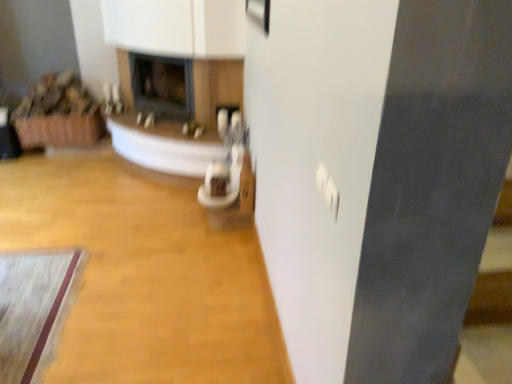
Question: Which direction should I rotate to face matte black fireplace at center, the second fireplace positioned from the left, — up or down?

Choices:
 (A) up
 (B) down

Answer: (A)

Question: Does wooden floor at center touch matte black fireplace at center, the 2th fireplace from the right?

Choices:
 (A) no
 (B) yes

Answer: (A)

Question: Can you confirm if wooden floor at center is smaller than matte black fireplace at center, the first fireplace when ordered from left to right?

Choices:
 (A) no
 (B) yes

Answer: (A)

Question: From a real-world perspective, does wooden floor at center stand above matte black fireplace at center, the 2th fireplace from the right?

Choices:
 (A) no
 (B) yes

Answer: (A)

Question: From the image's perspective, is wooden floor at center beneath matte black fireplace at center, the 2th fireplace from the right?

Choices:
 (A) yes
 (B) no

Answer: (A)

Question: Is wooden floor at center behind matte black fireplace at center, the first fireplace when ordered from left to right?

Choices:
 (A) yes
 (B) no

Answer: (B)

Question: Is wooden floor at center not close to matte black fireplace at center, the 2th fireplace from the right?

Choices:
 (A) no
 (B) yes

Answer: (A)

Question: Can you confirm if wooden floor at center is positioned to the left of matte black fireplace at center, the second fireplace positioned from the left?

Choices:
 (A) yes
 (B) no

Answer: (A)

Question: From the image's perspective, is wooden floor at center below matte black fireplace at center, the second fireplace positioned from the left?

Choices:
 (A) yes
 (B) no

Answer: (A)

Question: Is wooden floor at center positioned beyond the bounds of matte black fireplace at center, acting as the first fireplace starting from the right?

Choices:
 (A) yes
 (B) no

Answer: (A)

Question: Is the depth of wooden floor at center greater than that of matte black fireplace at center, acting as the first fireplace starting from the right?

Choices:
 (A) no
 (B) yes

Answer: (A)

Question: Does wooden floor at center turn towards matte black fireplace at center, acting as the first fireplace starting from the right?

Choices:
 (A) no
 (B) yes

Answer: (A)

Question: From a real-world perspective, is wooden floor at center positioned over matte black fireplace at center, the second fireplace positioned from the left, based on gravity?

Choices:
 (A) yes
 (B) no

Answer: (B)

Question: Is matte black fireplace at center, acting as the first fireplace starting from the right, facing away from wooden floor at center?

Choices:
 (A) yes
 (B) no

Answer: (B)